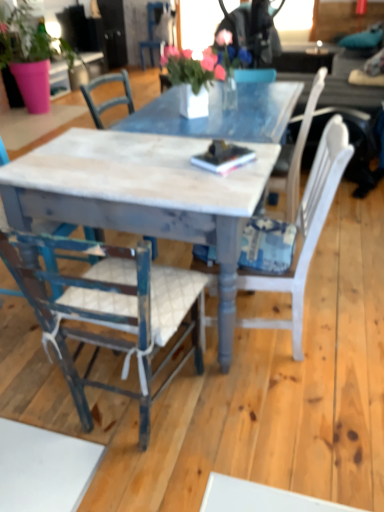
Question: Is distressed wood chair at center, which appears as the 1th chair when viewed from the front, thinner than pink fabric floral arrangement at center?

Choices:
 (A) yes
 (B) no

Answer: (A)

Question: Is distressed wood chair at center, the first chair in the bottom-to-top sequence, aimed at pink fabric floral arrangement at center?

Choices:
 (A) yes
 (B) no

Answer: (A)

Question: From the image's perspective, is distressed wood chair at center, which appears as the 1th chair when viewed from the front, above pink fabric floral arrangement at center?

Choices:
 (A) yes
 (B) no

Answer: (B)

Question: From a real-world perspective, is distressed wood chair at center, marked as the 4th chair in a back-to-front arrangement, over pink fabric floral arrangement at center?

Choices:
 (A) no
 (B) yes

Answer: (A)

Question: Does distressed wood chair at center, which appears as the 1th chair when viewed from the front, have a greater height compared to pink fabric floral arrangement at center?

Choices:
 (A) no
 (B) yes

Answer: (B)

Question: Is blue painted wood chair at upper center, marked as the first chair in a back-to-front arrangement, taller or shorter than white painted wood chair at left, the 2th chair in the back-to-front sequence?

Choices:
 (A) tall
 (B) short

Answer: (A)

Question: Visually, is blue painted wood chair at upper center, acting as the fourth chair starting from the front, positioned to the left or to the right of white painted wood chair at left, acting as the third chair starting from the front?

Choices:
 (A) left
 (B) right

Answer: (B)

Question: From the image's perspective, relative to white painted wood chair at left, which appears as the 2th chair when viewed from the top, is blue painted wood chair at upper center, the fourth chair when ordered from bottom to top, above or below?

Choices:
 (A) above
 (B) below

Answer: (A)

Question: From a real-world perspective, is blue painted wood chair at upper center, the fourth chair when ordered from bottom to top, above or below white painted wood chair at left, which appears as the 2th chair when viewed from the top?

Choices:
 (A) below
 (B) above

Answer: (B)

Question: Is blue painted wood chair at upper center, the fourth chair when ordered from bottom to top, in front of or behind distressed wood chair at center, which appears as the 1th chair when viewed from the front, in the image?

Choices:
 (A) front
 (B) behind

Answer: (B)

Question: From the image's perspective, is blue painted wood chair at upper center, positioned as the first chair in top-to-bottom order, above or below distressed wood chair at center, which is counted as the 4th chair, starting from the top?

Choices:
 (A) below
 (B) above

Answer: (B)

Question: Is point [x=150, y=38] positioned closer to the camera than point [x=145, y=324]?

Choices:
 (A) farther
 (B) closer

Answer: (A)

Question: Is blue painted wood chair at upper center, marked as the first chair in a back-to-front arrangement, inside or outside of distressed wood chair at center, marked as the 4th chair in a back-to-front arrangement?

Choices:
 (A) inside
 (B) outside

Answer: (B)

Question: Looking at the image, does pink fabric plant at left seem bigger or smaller compared to white painted wood chair at left, acting as the third chair starting from the front?

Choices:
 (A) big
 (B) small

Answer: (A)

Question: From the image's perspective, is pink fabric plant at left positioned above or below white painted wood chair at left, placed as the third chair when sorted from bottom to top?

Choices:
 (A) above
 (B) below

Answer: (A)